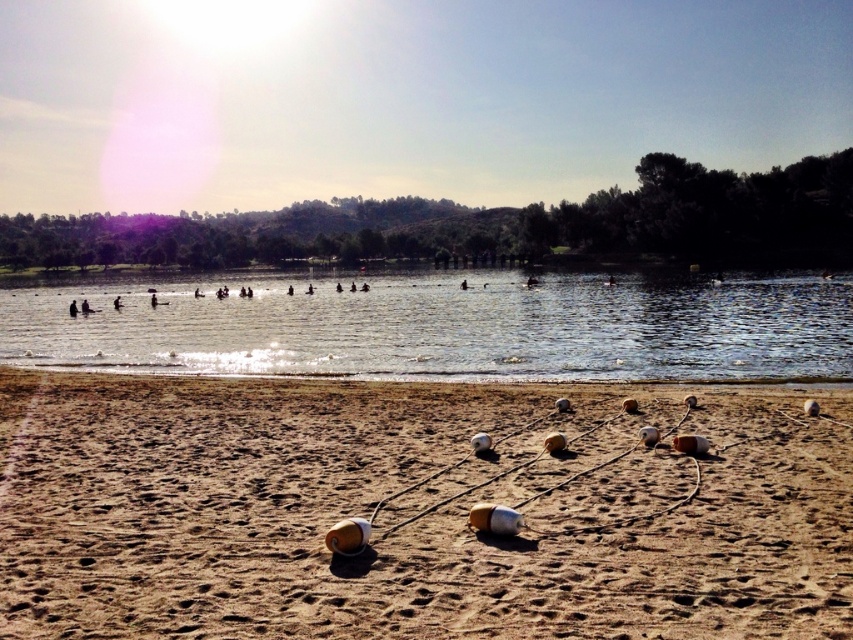
Question: Among these points, which one is farthest from the camera?

Choices:
 (A) (500, 289)
 (B) (637, 497)

Answer: (A)

Question: Is brown sandy beach at lower center to the right of clear water at center from the viewer's perspective?

Choices:
 (A) yes
 (B) no

Answer: (A)

Question: Among these points, which one is farthest from the camera?

Choices:
 (A) (250, 337)
 (B) (358, 566)

Answer: (A)

Question: Which of the following is the closest to the observer?

Choices:
 (A) (106, 330)
 (B) (465, 552)

Answer: (B)

Question: Does brown sandy beach at lower center have a lesser width compared to clear water at center?

Choices:
 (A) yes
 (B) no

Answer: (A)

Question: In this image, where is brown sandy beach at lower center located relative to clear water at center?

Choices:
 (A) right
 (B) left

Answer: (A)